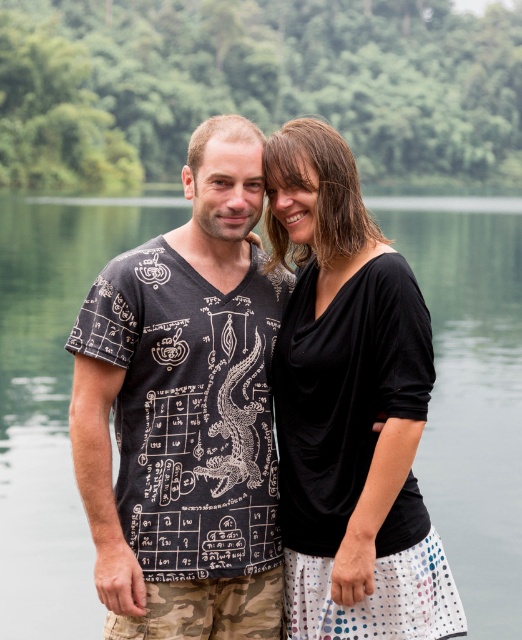
Question: Is black printed t-shirt at center positioned before black matte dress at center?

Choices:
 (A) yes
 (B) no

Answer: (B)

Question: Which point is farther from the camera taking this photo?

Choices:
 (A) (420, 588)
 (B) (489, 509)
 (C) (234, 504)

Answer: (B)

Question: Which of these objects is positioned farthest from the transparent water at center?

Choices:
 (A) black printed t-shirt at center
 (B) black matte dress at center

Answer: (B)

Question: Does transparent water at center have a greater width compared to black matte dress at center?

Choices:
 (A) yes
 (B) no

Answer: (A)

Question: Is black printed t-shirt at center to the right of black matte dress at center from the viewer's perspective?

Choices:
 (A) yes
 (B) no

Answer: (B)

Question: Among these points, which one is farthest from the camera?

Choices:
 (A) (307, 260)
 (B) (179, 371)

Answer: (A)